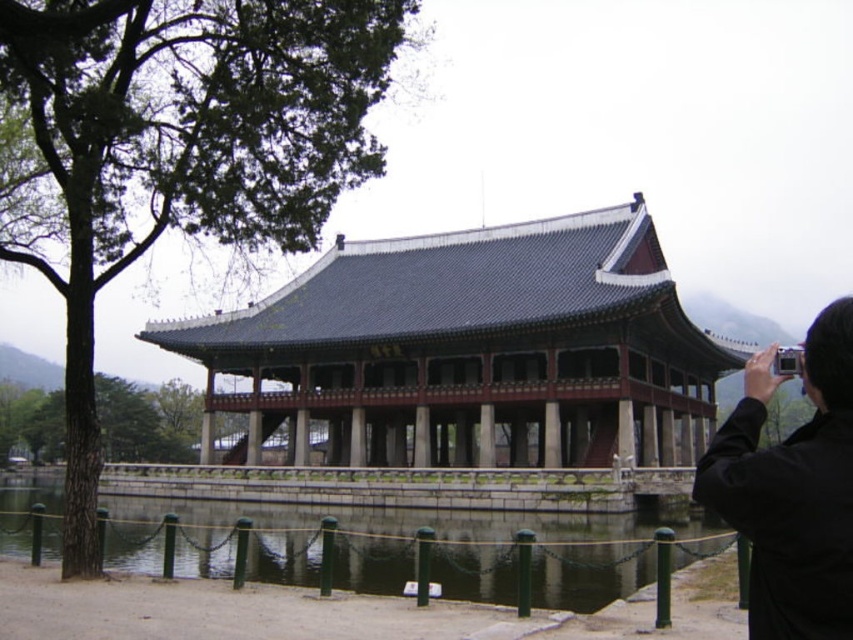
Question: Which point is farther to the camera?

Choices:
 (A) (323, 388)
 (B) (824, 618)

Answer: (A)

Question: Among these objects, which one is farthest from the camera?

Choices:
 (A) black fabric camera at upper right
 (B) shiny dark gray roof at center

Answer: (B)

Question: Is clear water at pond center smaller than black fabric camera at upper right?

Choices:
 (A) yes
 (B) no

Answer: (A)

Question: Is shiny dark gray roof at center below clear water at pond center?

Choices:
 (A) no
 (B) yes

Answer: (A)

Question: Estimate the real-world distances between objects in this image. Which object is farther from the shiny dark gray roof at center?

Choices:
 (A) black fabric camera at upper right
 (B) clear water at pond center

Answer: (A)

Question: Does shiny dark gray roof at center appear over black fabric camera at upper right?

Choices:
 (A) no
 (B) yes

Answer: (B)